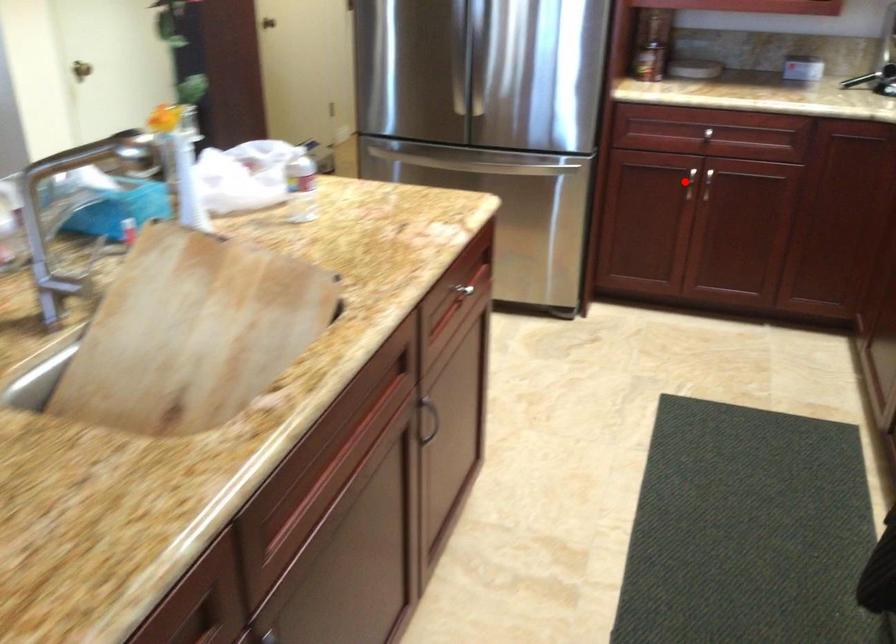
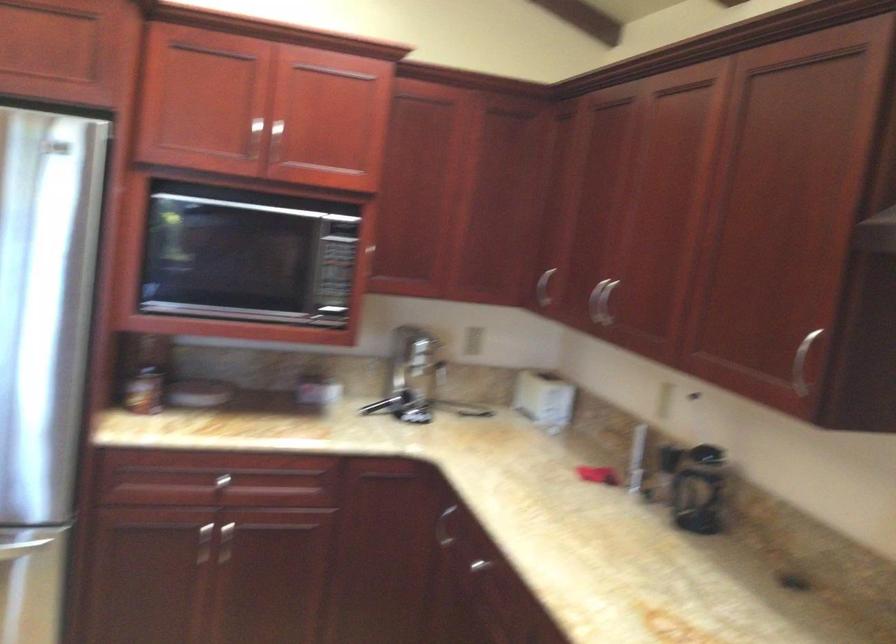
Question: I am providing you with two images of the same scene from different viewpoints. A red point is shown in image1. For the corresponding object point in image2, is it positioned nearer or farther from the camera?

Choices:
 (A) Nearer
 (B) Farther

Answer: (A)